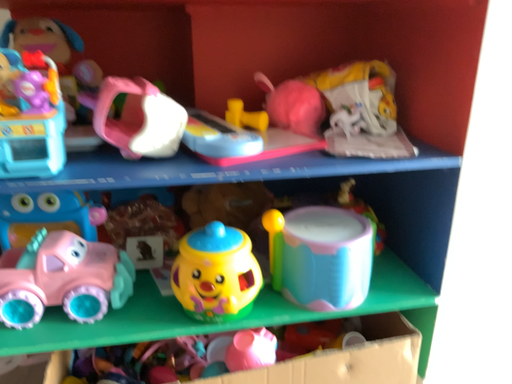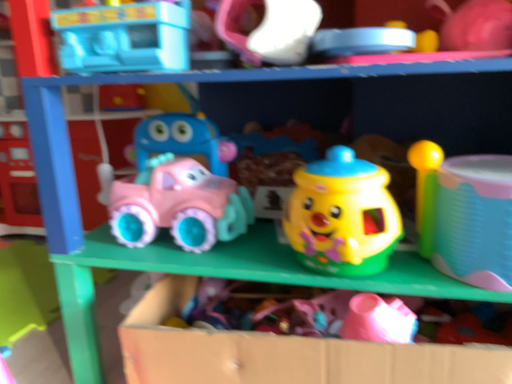
Question: How did the camera likely rotate when shooting the video?

Choices:
 (A) rotated right
 (B) rotated left

Answer: (B)